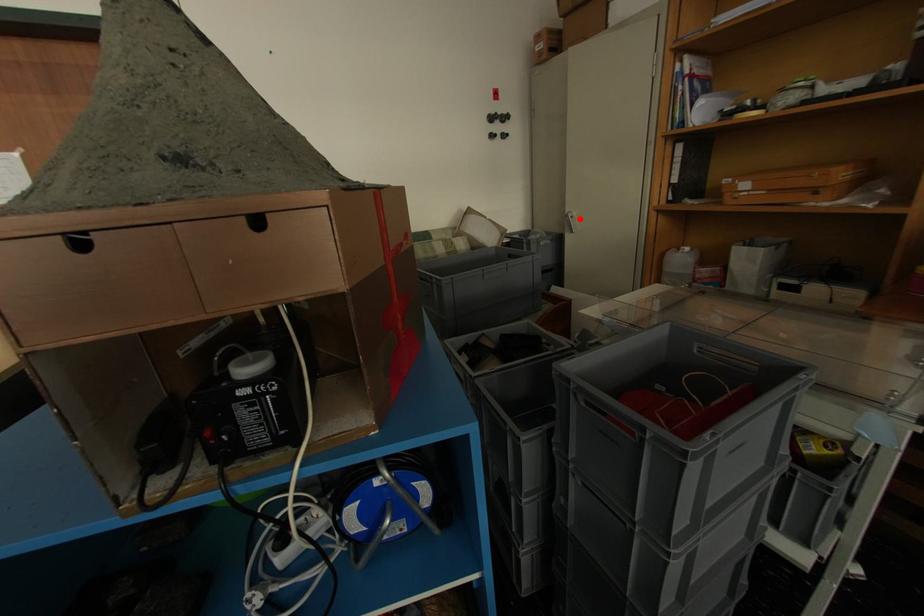
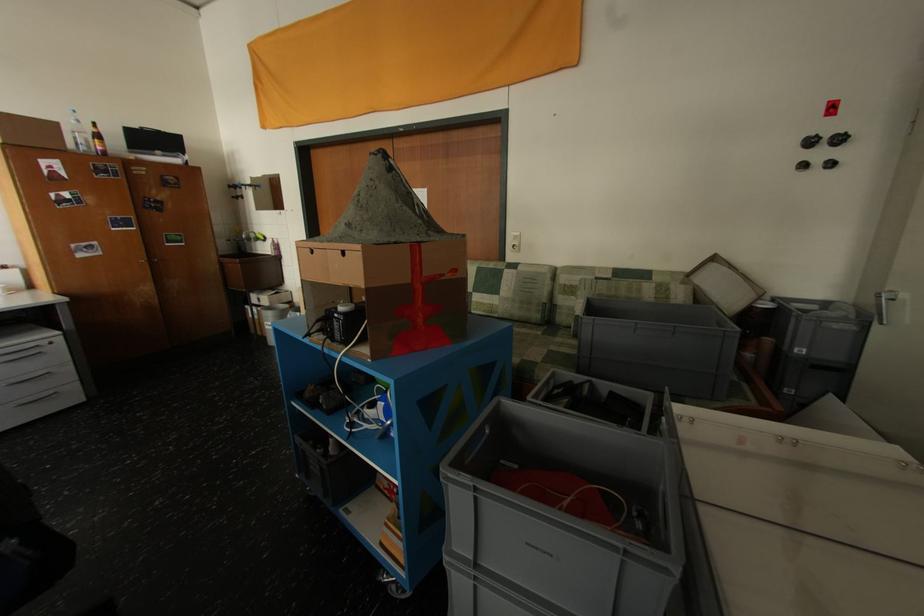
In the second image, find the point that corresponds to the highlighted location in the first image.

(902, 301)